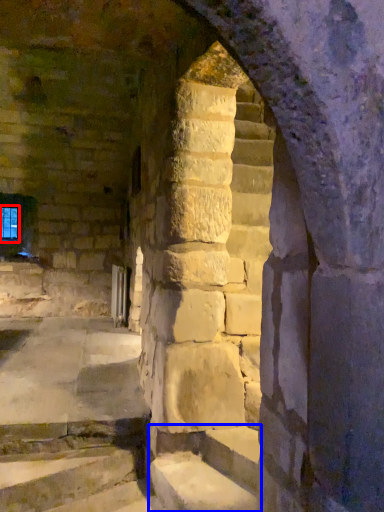
Question: Which of the following is the farthest to the observer, glass window (highlighted by a red box) or stairwell (highlighted by a blue box)?

Choices:
 (A) glass window
 (B) stairwell

Answer: (A)